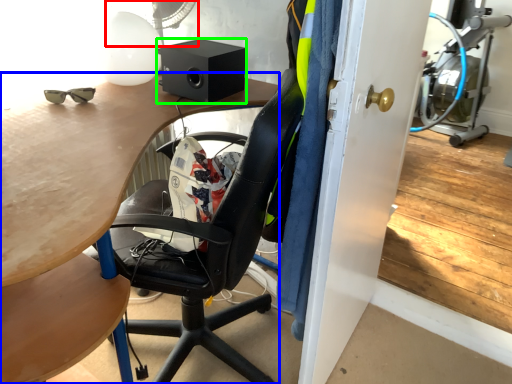
Question: Which object is positioned closest to mechanical fan (highlighted by a red box)? Select from desk (highlighted by a blue box) and loudspeaker (highlighted by a green box).

Choices:
 (A) desk
 (B) loudspeaker

Answer: (B)